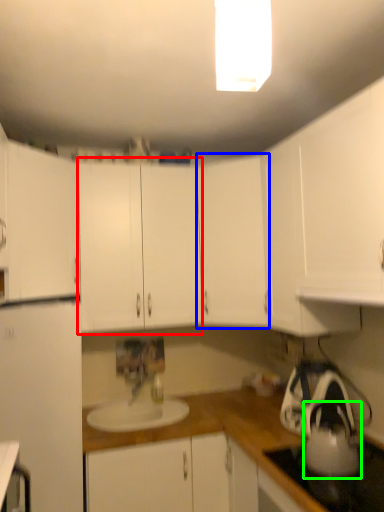
Question: Which object is the farthest from cabinetry (highlighted by a red box)? Choose among these: cabinetry (highlighted by a blue box) or tea pot (highlighted by a green box).

Choices:
 (A) cabinetry
 (B) tea pot

Answer: (B)